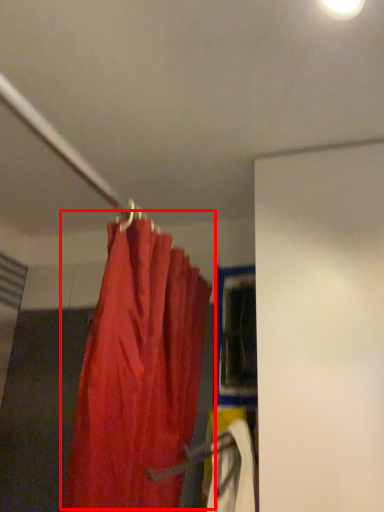
Question: In this image, where is curtain (annotated by the red box) located relative to window?

Choices:
 (A) left
 (B) right

Answer: (A)